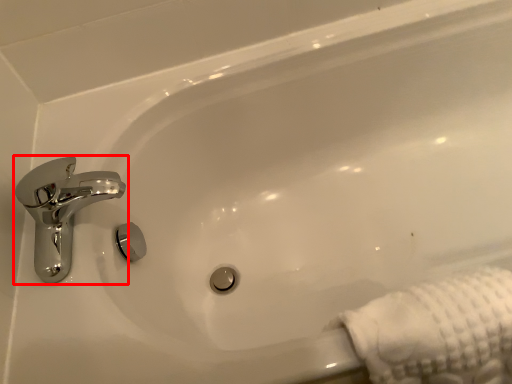
Question: In this image, where is tap (annotated by the red box) located relative to bath towel?

Choices:
 (A) left
 (B) right

Answer: (A)